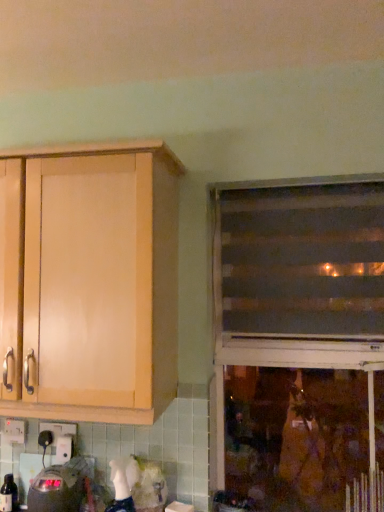
Question: Can you confirm if brown striped blinds at right, which is the second window from bottom to top, is smaller than matte wooden window at right, placed as the first window when sorted from bottom to top?

Choices:
 (A) yes
 (B) no

Answer: (A)

Question: From a real-world perspective, is brown striped blinds at right, positioned as the first window in top-to-bottom order, beneath matte wooden window at right, placed as the first window when sorted from bottom to top?

Choices:
 (A) no
 (B) yes

Answer: (A)

Question: Can you confirm if brown striped blinds at right, which is the second window from bottom to top, is taller than matte wooden window at right, placed as the first window when sorted from bottom to top?

Choices:
 (A) yes
 (B) no

Answer: (B)

Question: Is matte wooden window at right, marked as the second window in a top-to-bottom arrangement, located within brown striped blinds at right, which is the second window from bottom to top?

Choices:
 (A) yes
 (B) no

Answer: (B)

Question: From the image's perspective, is brown striped blinds at right, which is the second window from bottom to top, above matte wooden window at right, placed as the first window when sorted from bottom to top?

Choices:
 (A) no
 (B) yes

Answer: (B)

Question: Visually, is translucent glass bottle at lower left positioned to the left or to the right of brown striped blinds at right, positioned as the first window in top-to-bottom order?

Choices:
 (A) left
 (B) right

Answer: (A)

Question: Considering their positions, is translucent glass bottle at lower left located in front of or behind brown striped blinds at right, positioned as the first window in top-to-bottom order?

Choices:
 (A) behind
 (B) front

Answer: (A)

Question: Considering the positions of translucent glass bottle at lower left and brown striped blinds at right, which is the second window from bottom to top, in the image, is translucent glass bottle at lower left taller or shorter than brown striped blinds at right, which is the second window from bottom to top,?

Choices:
 (A) short
 (B) tall

Answer: (A)

Question: Considering the positions of point coord(3,486) and point coord(221,291), is point coord(3,486) closer or farther from the camera than point coord(221,291)?

Choices:
 (A) closer
 (B) farther

Answer: (A)

Question: In the image, is matte black digital clock at lower left on the left side or the right side of matte wooden window at right, placed as the first window when sorted from bottom to top?

Choices:
 (A) left
 (B) right

Answer: (A)

Question: Choose the correct answer: Is matte black digital clock at lower left inside matte wooden window at right, placed as the first window when sorted from bottom to top, or outside it?

Choices:
 (A) outside
 (B) inside

Answer: (A)

Question: Looking at the image, does matte black digital clock at lower left seem bigger or smaller compared to matte wooden window at right, placed as the first window when sorted from bottom to top?

Choices:
 (A) small
 (B) big

Answer: (A)

Question: Is point (57, 465) positioned closer to the camera than point (359, 437)?

Choices:
 (A) closer
 (B) farther

Answer: (A)

Question: Is brown striped blinds at right, positioned as the first window in top-to-bottom order, taller or shorter than black plastic electric outlet at lower left, the 1th electric outlet when ordered from right to left?

Choices:
 (A) short
 (B) tall

Answer: (B)

Question: Choose the correct answer: Is brown striped blinds at right, which is the second window from bottom to top, inside black plastic electric outlet at lower left, the 1th electric outlet when ordered from right to left, or outside it?

Choices:
 (A) inside
 (B) outside

Answer: (B)